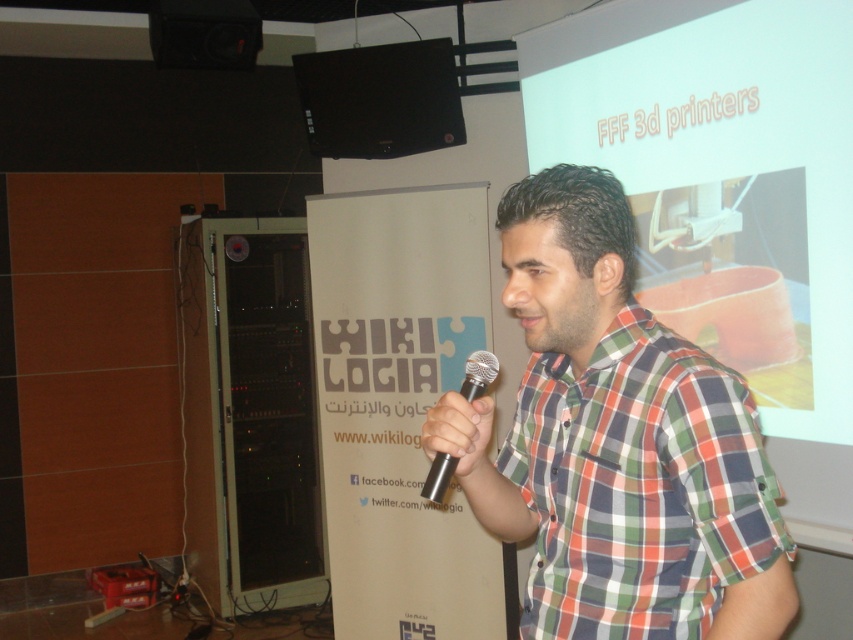
You are an attendee at this event and want to take a photo of the speaker. Since the projector screen is bright, will the plaid cotton shirt at center be in focus if you focus on the matte white projector screen at upper center?

The plaid cotton shirt at center is closer to the viewer than the matte white projector screen at upper center. If you focus on the matte white projector screen at upper center, the plaid cotton shirt at center may not be in focus because it is at a different distance.